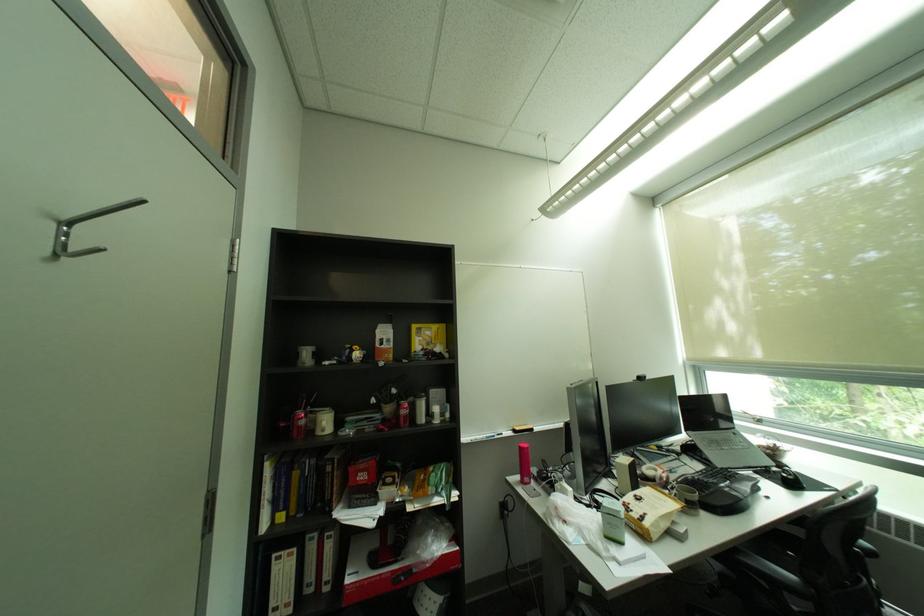
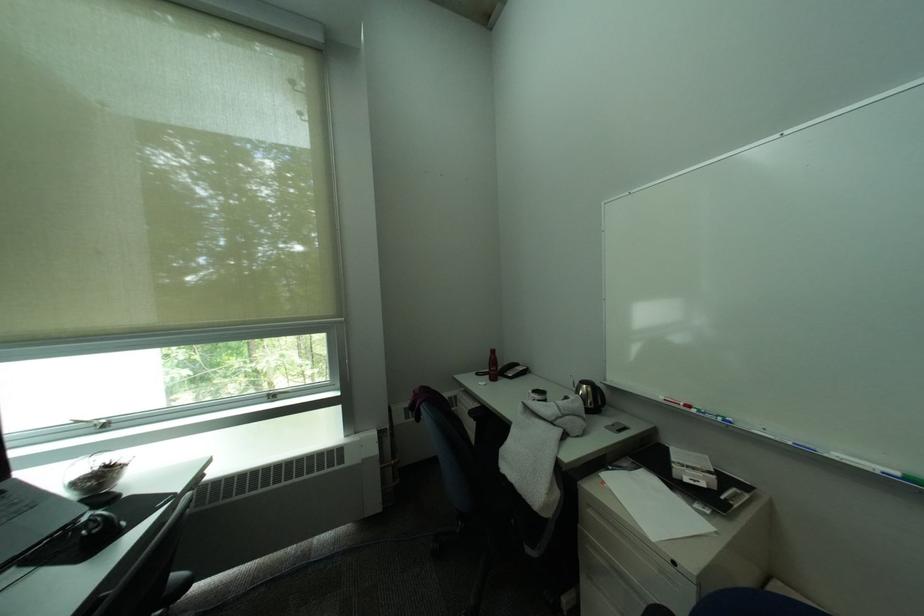
The point at (771, 448) is marked in the first image. Where is the corresponding point in the second image?

(84, 485)